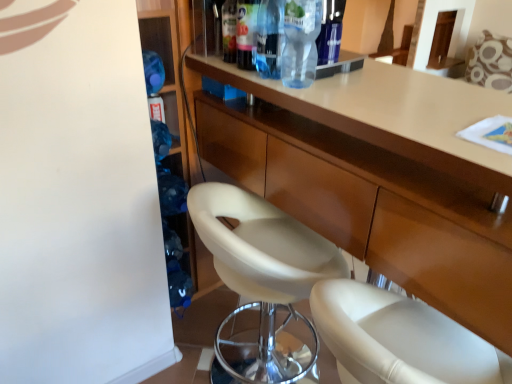
Locate an element on the screen. Image resolution: width=512 pixels, height=384 pixels. vacant space that is to the left of transparent plastic bottle at upper center, the first bottle in the right-to-left sequence is located at coordinates (258, 80).